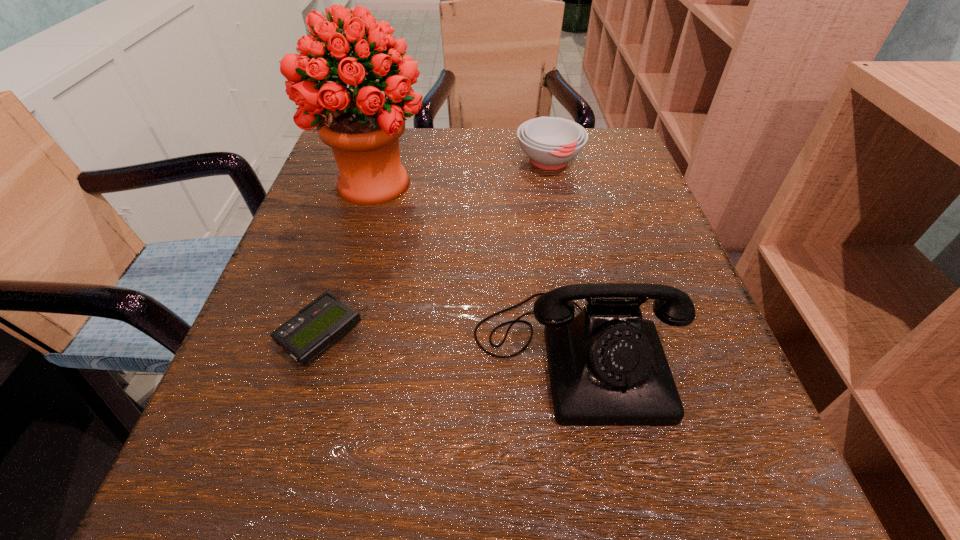
Find the location of a particular element. free region at the near left corner of the desktop is located at coordinates (274, 472).

Where is `free space at the near right corner of the desktop`? free space at the near right corner of the desktop is located at coordinates (713, 463).

I want to click on vacant space that is in between the shortest object and the bouquet, so click(x=348, y=260).

Identify the location of free spot between the second shortest object and the bouquet. This screenshot has width=960, height=540. (462, 173).

Identify the location of blank region between the third shortest object and the bouquet. (475, 268).

You are a GUI agent. You are given a task and a screenshot of the screen. Output one action in this format:
    pyautogui.click(x=<x>, y=<y>)
    Task: Click on the unoccupied position between the second shortest object and the bouquet
    
    Given the screenshot: What is the action you would take?
    pyautogui.click(x=462, y=173)

I want to click on vacant point located between the bouquet and the third shortest object, so click(x=475, y=268).

This screenshot has height=540, width=960. What are the coordinates of `vacant space that's between the second shortest object and the bouquet` in the screenshot? It's located at (462, 173).

Where is `vacant area between the third tallest object and the tallest object`? vacant area between the third tallest object and the tallest object is located at coordinates (462, 173).

This screenshot has height=540, width=960. I want to click on vacant space that is in between the telephone and the third tallest object, so click(x=563, y=257).